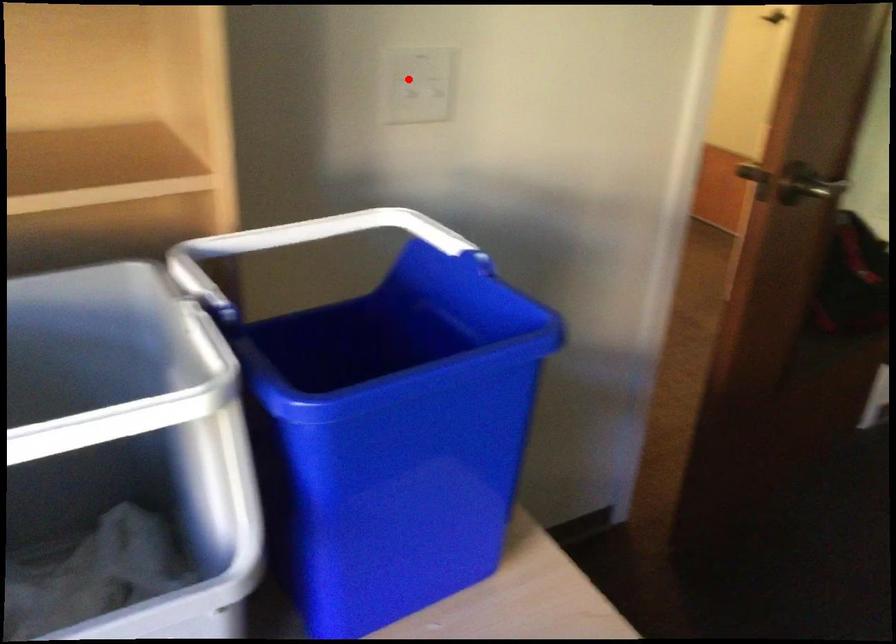
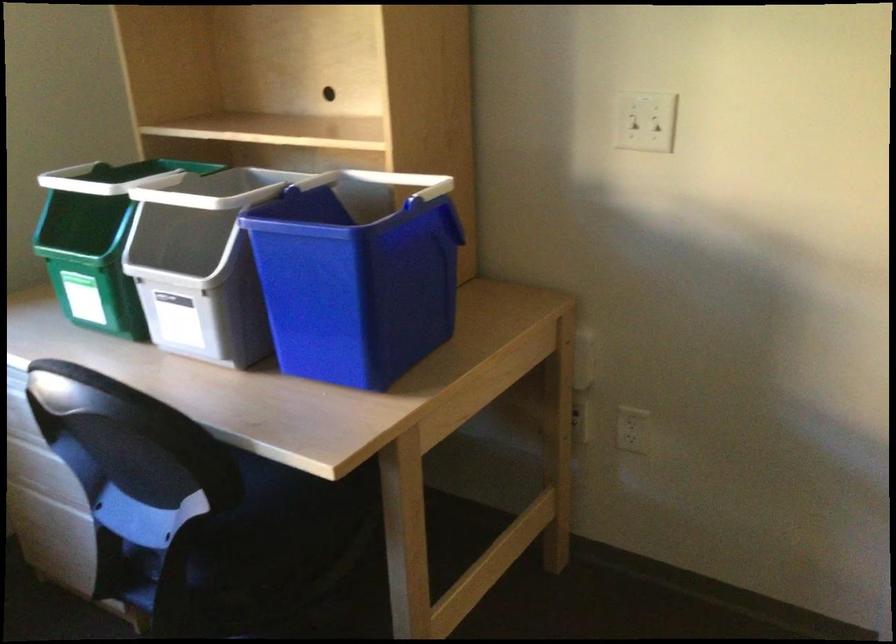
Find the pixel in the second image that matches the highlighted location in the first image.

(643, 118)